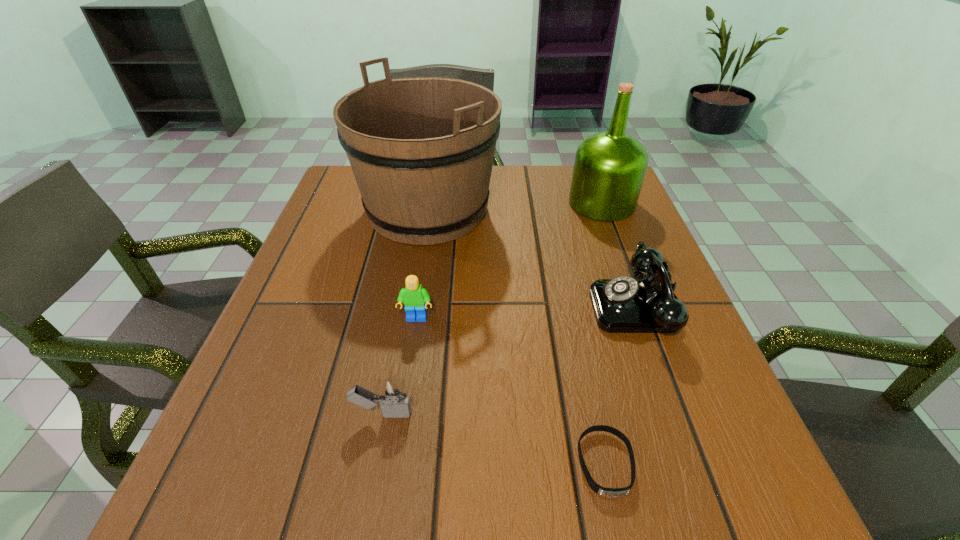
At what (x,y) coordinates should I click in order to perform the action: click on bucket. Please return your answer as a coordinate pair (x, y). This screenshot has width=960, height=540. Looking at the image, I should click on (421, 149).

The image size is (960, 540). I want to click on olive oil, so click(x=609, y=168).

Find the location of `Lego`. Lego is located at coordinates (414, 297).

Identify the location of telephone. The height and width of the screenshot is (540, 960). (624, 304).

Find the location of a particular element. igniter is located at coordinates (392, 396).

Locate an element on the screen. Image resolution: width=960 pixels, height=540 pixels. the third object from right to left is located at coordinates (606, 492).

Locate an element on the screen. The image size is (960, 540). the shortest object is located at coordinates (606, 492).

The image size is (960, 540). In order to click on vacant region located 0.070m on the back of the bucket in this screenshot , I will do `click(435, 164)`.

Image resolution: width=960 pixels, height=540 pixels. Identify the location of vacant space located on the back of the olive oil. (589, 170).

The height and width of the screenshot is (540, 960). Identify the location of vacant space located 0.060m on the face of the Lego. (412, 350).